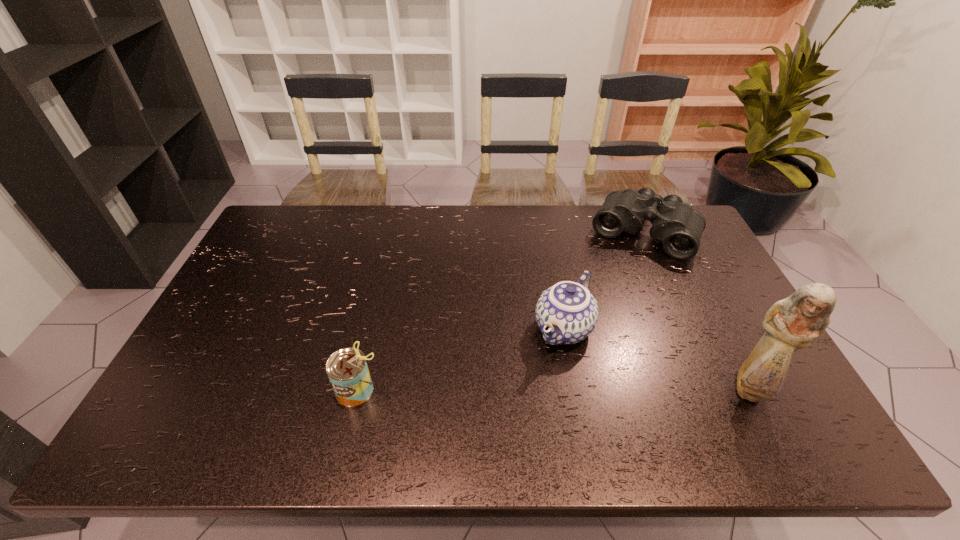
The height and width of the screenshot is (540, 960). Find the location of `empty space between the figurine and the chinaware`. empty space between the figurine and the chinaware is located at coordinates (657, 359).

Where is `free space that is in between the chinaware and the farthest object`? This screenshot has width=960, height=540. free space that is in between the chinaware and the farthest object is located at coordinates (604, 281).

Locate an element on the screen. The width and height of the screenshot is (960, 540). free space between the figurine and the chinaware is located at coordinates (657, 359).

Locate an element on the screen. unoccupied area between the tallest object and the third nearest object is located at coordinates (657, 359).

This screenshot has height=540, width=960. Find the location of `empty location between the tallest object and the second object from left to right`. empty location between the tallest object and the second object from left to right is located at coordinates (657, 359).

The image size is (960, 540). Identify the location of the second closest object to the figurine. pos(674,223).

Identify which object is the second closest to the farthest object. Please provide its 2D coordinates. Your answer should be formatted as a tuple, i.e. [(x, y)], where the tuple contains the x and y coordinates of a point satisfying the conditions above.

[(793, 323)]

Locate an element on the screen. This screenshot has width=960, height=540. blank area in the image that satisfies the following two spatial constraints: 1. on the back side of the third object from right to left; 2. on the left side of the leftmost object is located at coordinates (372, 328).

The width and height of the screenshot is (960, 540). I want to click on free space that satisfies the following two spatial constraints: 1. on the back side of the second object from left to right; 2. on the right side of the leftmost object, so click(x=372, y=328).